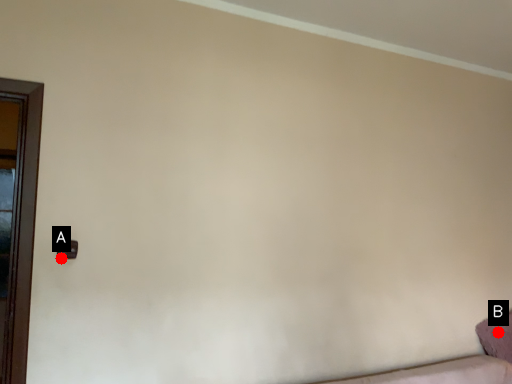
Question: Two points are circled on the image, labeled by A and B beside each circle. Among these points, which one is farthest from the camera?

Choices:
 (A) A is further
 (B) B is further

Answer: (B)